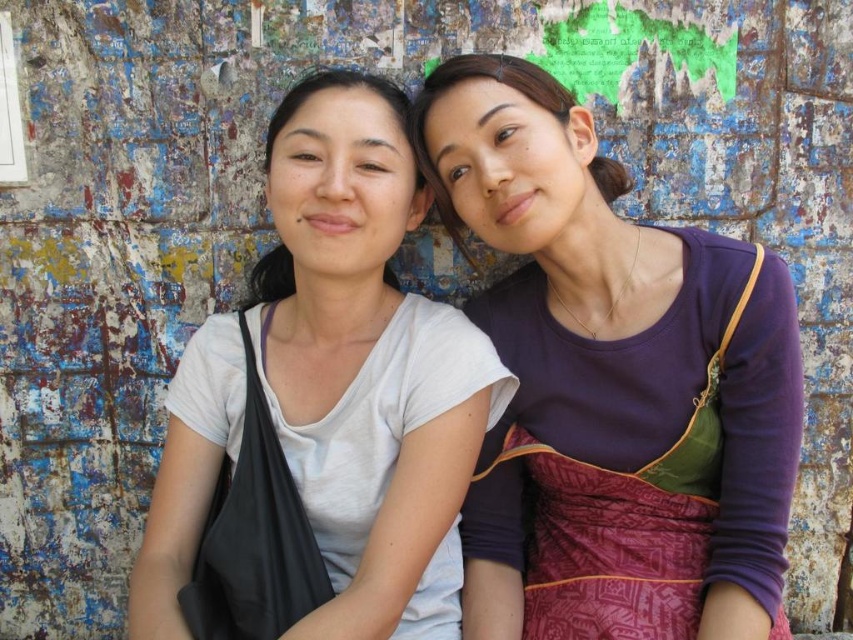
Question: Is white matte t-shirt at center closer to the viewer compared to matte purple dress at upper right?

Choices:
 (A) yes
 (B) no

Answer: (A)

Question: Based on their relative distances, which object is nearer to the purple cotton dress at center?

Choices:
 (A) matte purple dress at upper right
 (B) white matte t-shirt at center
 (C) white matte shirt at center

Answer: (B)

Question: Which point is closer to the camera taking this photo?

Choices:
 (A) (291, 257)
 (B) (479, 468)
 (C) (503, 76)

Answer: (C)

Question: Which of the following is the closest to the observer?

Choices:
 (A) (544, 472)
 (B) (274, 268)

Answer: (A)

Question: Does white matte t-shirt at center appear over white matte shirt at center?

Choices:
 (A) yes
 (B) no

Answer: (B)

Question: Is white matte t-shirt at center to the left of matte purple dress at upper right from the viewer's perspective?

Choices:
 (A) yes
 (B) no

Answer: (A)